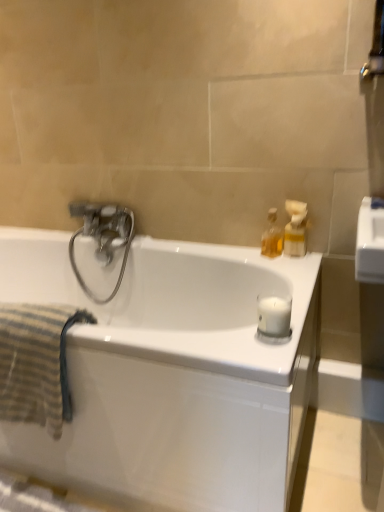
Question: Is white glossy bathtub at center turned away from white matte candle at right?

Choices:
 (A) yes
 (B) no

Answer: (B)

Question: Does white glossy bathtub at center turn towards white matte candle at right?

Choices:
 (A) yes
 (B) no

Answer: (B)

Question: Considering the relative sizes of white glossy bathtub at center and white matte candle at right in the image provided, is white glossy bathtub at center taller than white matte candle at right?

Choices:
 (A) no
 (B) yes

Answer: (B)

Question: Would you say white matte candle at right is part of white glossy bathtub at center's contents?

Choices:
 (A) yes
 (B) no

Answer: (B)

Question: Is white glossy bathtub at center next to white matte candle at right?

Choices:
 (A) yes
 (B) no

Answer: (B)

Question: In terms of size, does white glossy bathtub at center appear bigger or smaller than translucent plastic soap dispenser at upper right, the 2th soap dispenser positioned from the left?

Choices:
 (A) small
 (B) big

Answer: (B)

Question: In the image, is white glossy bathtub at center on the left side or the right side of translucent plastic soap dispenser at upper right, the 2th soap dispenser positioned from the left?

Choices:
 (A) right
 (B) left

Answer: (B)

Question: From their relative heights in the image, would you say white glossy bathtub at center is taller or shorter than translucent plastic soap dispenser at upper right, which is counted as the 1th soap dispenser, starting from the right?

Choices:
 (A) tall
 (B) short

Answer: (A)

Question: From the image's perspective, is white glossy bathtub at center positioned above or below translucent plastic soap dispenser at upper right, the 2th soap dispenser positioned from the left?

Choices:
 (A) below
 (B) above

Answer: (A)

Question: From a real-world perspective, is translucent glass bottle at upper right, which is counted as the 1th soap dispenser, starting from the left, physically located above or below white glossy bathtub at center?

Choices:
 (A) above
 (B) below

Answer: (A)

Question: Looking at their shapes, would you say translucent glass bottle at upper right, which is counted as the 1th soap dispenser, starting from the left, is wider or thinner than white glossy bathtub at center?

Choices:
 (A) thin
 (B) wide

Answer: (A)

Question: Which is correct: translucent glass bottle at upper right, which is counted as the 1th soap dispenser, starting from the left, is inside white glossy bathtub at center, or outside of it?

Choices:
 (A) outside
 (B) inside

Answer: (A)

Question: Is point (266, 241) closer or farther from the camera than point (269, 355)?

Choices:
 (A) closer
 (B) farther

Answer: (B)

Question: Is metallic silver towel bar at upper right spatially inside white matte candle at right, or outside of it?

Choices:
 (A) outside
 (B) inside

Answer: (A)

Question: Is metallic silver towel bar at upper right to the left or to the right of white matte candle at right in the image?

Choices:
 (A) left
 (B) right

Answer: (B)